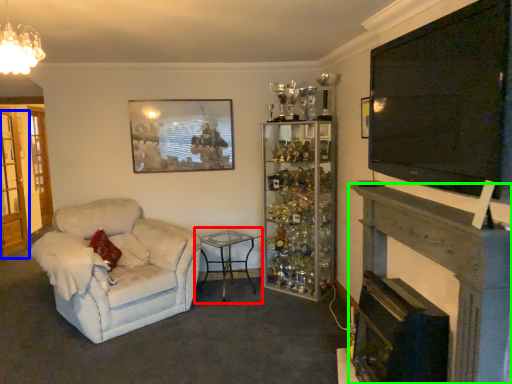
Question: Based on their relative distances, which object is nearer to table (highlighted by a red box)? Choose from glass door (highlighted by a blue box) and fireplace (highlighted by a green box).

Choices:
 (A) glass door
 (B) fireplace

Answer: (B)